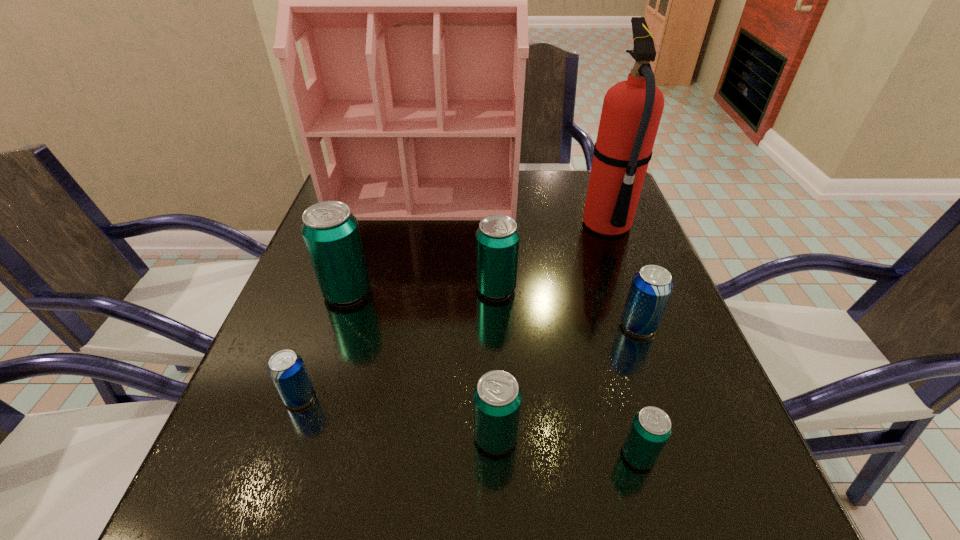
At what (x,y) coordinates should I click in order to perform the action: click on dollhouse. Please return your answer as a coordinate pair (x, y). The height and width of the screenshot is (540, 960). Looking at the image, I should click on (410, 0).

This screenshot has width=960, height=540. Identify the location of red fire extinguisher. (632, 109).

Locate an element on the screen. The height and width of the screenshot is (540, 960). the biggest teal beer can is located at coordinates (330, 231).

The width and height of the screenshot is (960, 540). Find the location of `the leftmost teal beer can`. the leftmost teal beer can is located at coordinates (330, 231).

The width and height of the screenshot is (960, 540). I want to click on the fourth tallest object, so click(x=497, y=239).

Where is `the fifth shortest beer can`? This screenshot has height=540, width=960. the fifth shortest beer can is located at coordinates (497, 239).

The image size is (960, 540). I want to click on the bigger blue beer can, so click(651, 287).

Find the location of a particular element. This screenshot has width=960, height=540. the farther blue beer can is located at coordinates (651, 287).

Find the location of a particular element. This screenshot has height=540, width=960. the third biggest teal beer can is located at coordinates (497, 397).

You are a GUI agent. You are given a task and a screenshot of the screen. Output one action in this format:
    pyautogui.click(x=<x>, y=<y>)
    Task: Click on the fourth farthest beer can
    
    Given the screenshot: What is the action you would take?
    point(286,368)